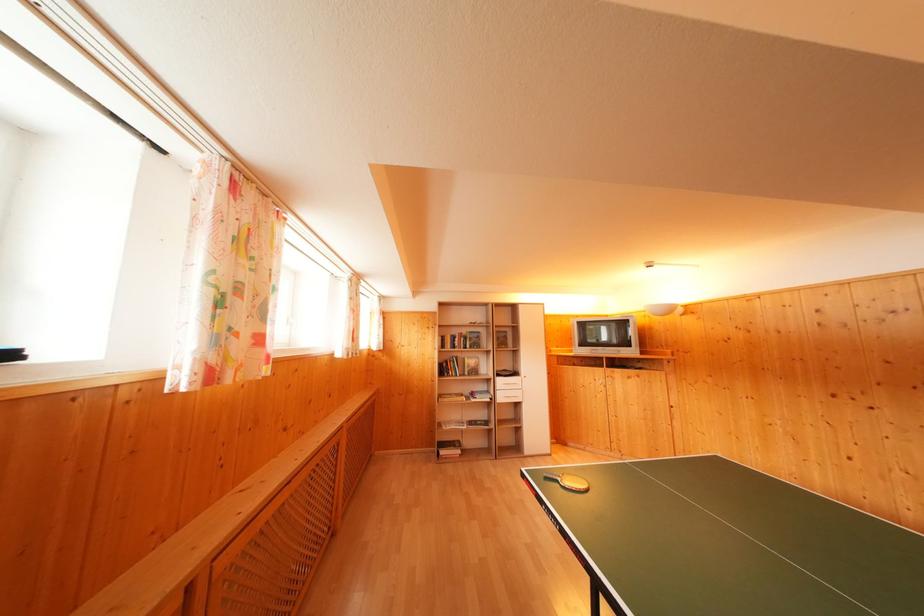
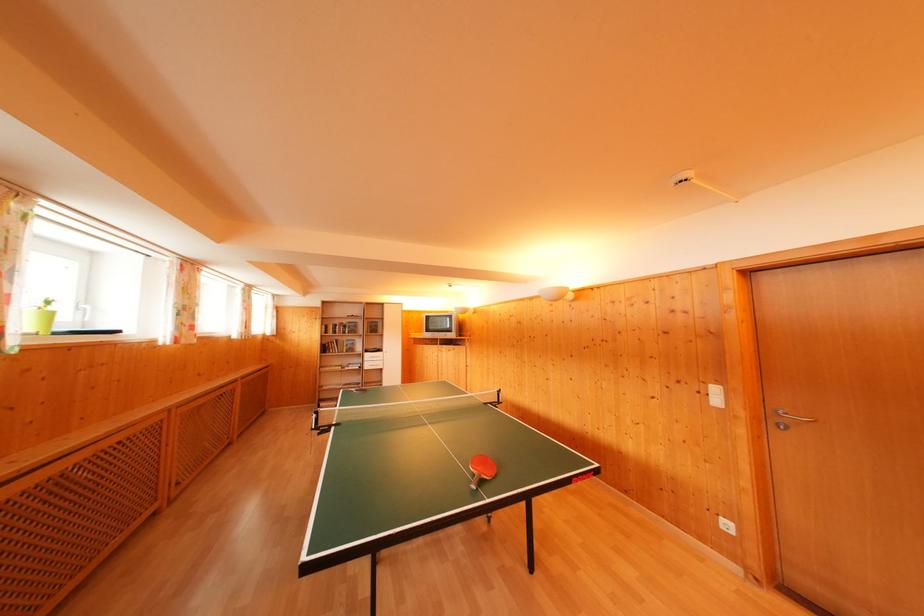
Locate, in the second image, the point that corresponds to [468,336] in the first image.

(349, 326)